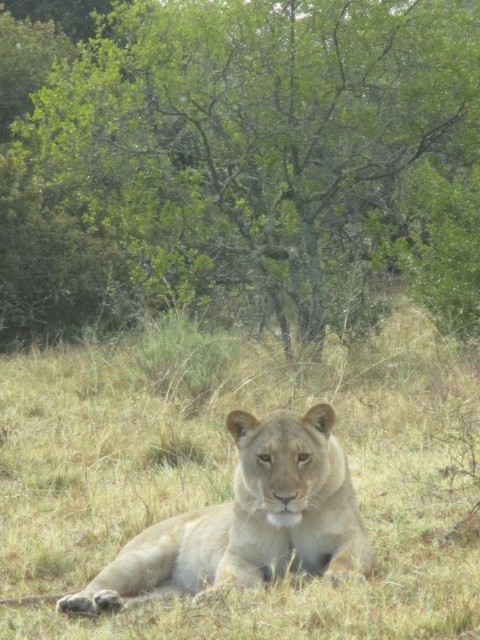
Does yellow dry grass at center have a smaller size compared to light brown fur lion at center?

Correct, yellow dry grass at center occupies less space than light brown fur lion at center.

Does point (112, 625) come closer to viewer compared to point (228, 524)?

Yes, it is in front of point (228, 524).

Measure the distance between point (x=10, y=458) and camera.

Point (x=10, y=458) is 6.55 meters from camera.

Image resolution: width=480 pixels, height=640 pixels. I want to click on yellow dry grass at center, so (x=362, y=516).

Between point (441, 266) and point (216, 544), which one is positioned behind?

Point (441, 266)

Which is behind, point (84, 160) or point (303, 448)?

The point (84, 160) is behind.

Identify the location of green leafy tree at center. This screenshot has height=640, width=480. (240, 164).

Is green leafy tree at center to the left of yellow dry grass at center from the viewer's perspective?

In fact, green leafy tree at center is to the right of yellow dry grass at center.

Does point (28, 116) come behind point (168, 420)?

Yes.

Which is behind, point (63, 115) or point (365, 374)?

Point (63, 115)

I want to click on green leafy tree at center, so click(240, 164).